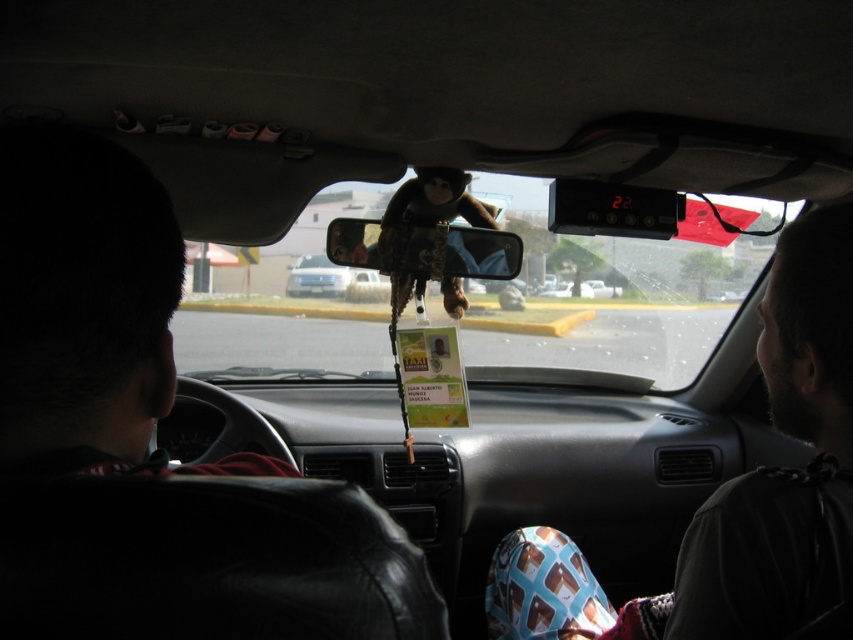
Looking at this image, you are sitting in the backseat of the taxi and want to reach a point located at coordinates point (488, 630). Can you comfortably reach it with your hand?

The point (488, 630) is 2.62 meters away from the viewer, so it is too far to reach with your hand from the backseat.

You are a passenger in a taxi and need to place a 1.5 meter long object between the matte plastic view mirror at center and the silver metallic car at center. Is there enough space?

The matte plastic view mirror at center is 1.59 meters from the silver metallic car at center. Since the object is 1.5 meters long, there is enough space to place it between them.